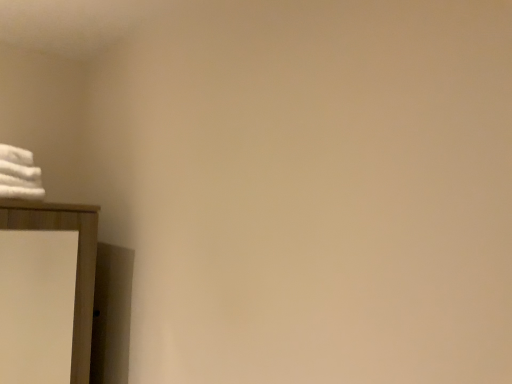
What is the approximate width of white soft bath towel at upper left?

white soft bath towel at upper left is 18.71 inches in width.

Describe the element at coordinates (19, 174) in the screenshot. The height and width of the screenshot is (384, 512). I see `white soft bath towel at upper left` at that location.

What are the coordinates of `white soft bath towel at upper left` in the screenshot? It's located at (19, 174).

Where is `white soft bath towel at upper left`? The width and height of the screenshot is (512, 384). white soft bath towel at upper left is located at coordinates (19, 174).